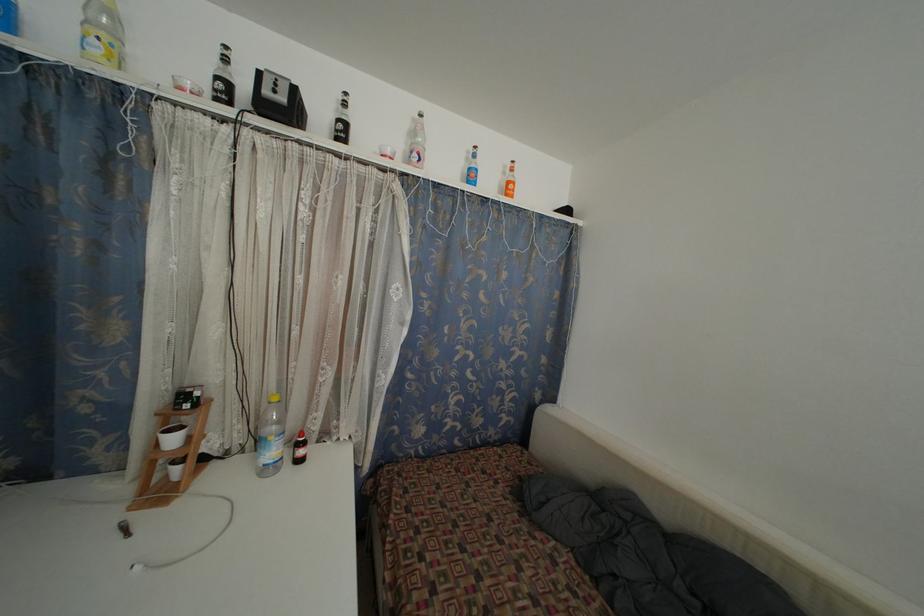
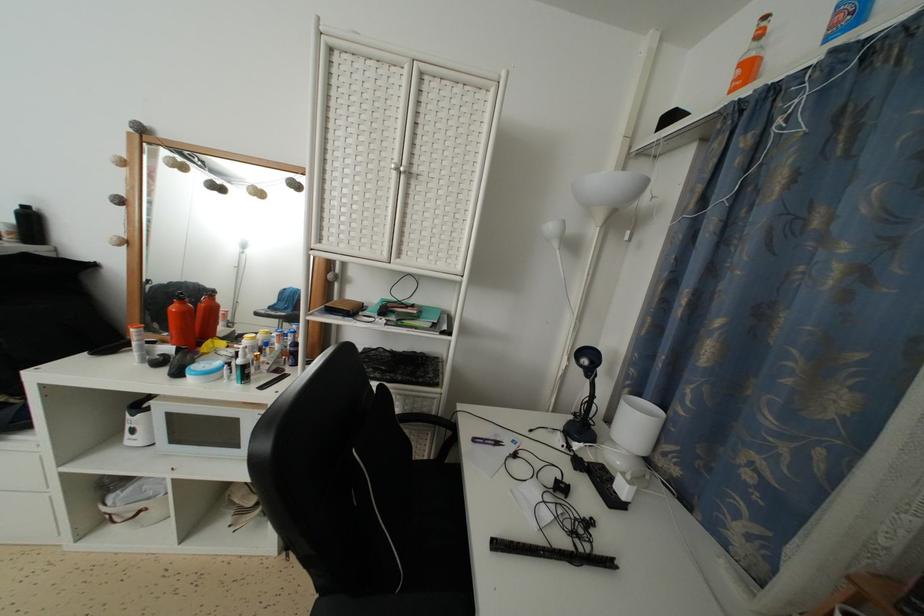
Question: The first image is from the beginning of the video and the second image is from the end. How did the camera likely rotate when shooting the video?

Choices:
 (A) Left
 (B) Right
 (C) Up
 (D) Down

Answer: (A)